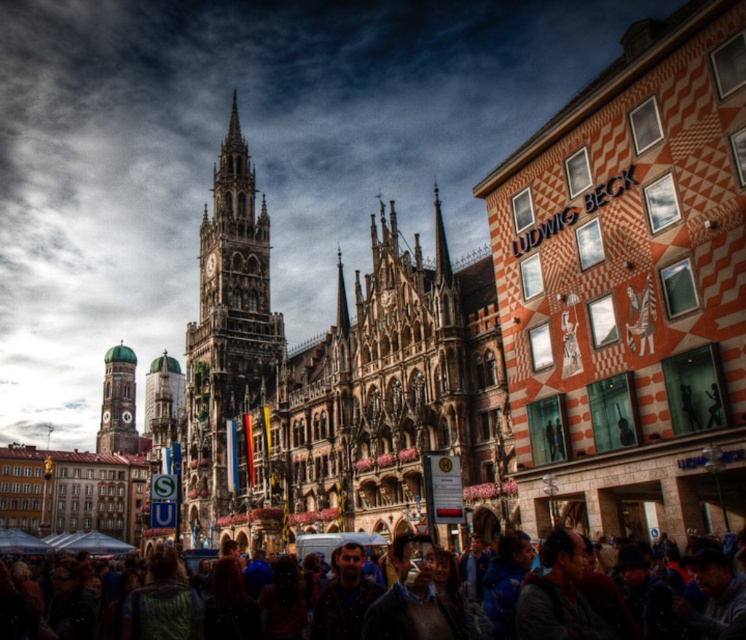
You are standing in the middle of the bustling urban scene. You want to take a photo of the dark stone clock tower at center. Where should you position yourself to capture it in the frame?

You should position yourself at point (x=231, y=356) to capture the dark stone clock tower at center in the frame.

You are standing in the city square and want to take a photo of the dark stone clock tower at center. If you are currently 266.37 feet away from it, is this a suitable distance for capturing the entire structure in one frame?

The dark stone clock tower at center is 266.37 feet away from the camera. This distance may be too far to capture the entire structure in one frame with standard camera equipment, as most lenses struggle to encompass such a large building from that range. Consider moving closer or using a wide angle lens.